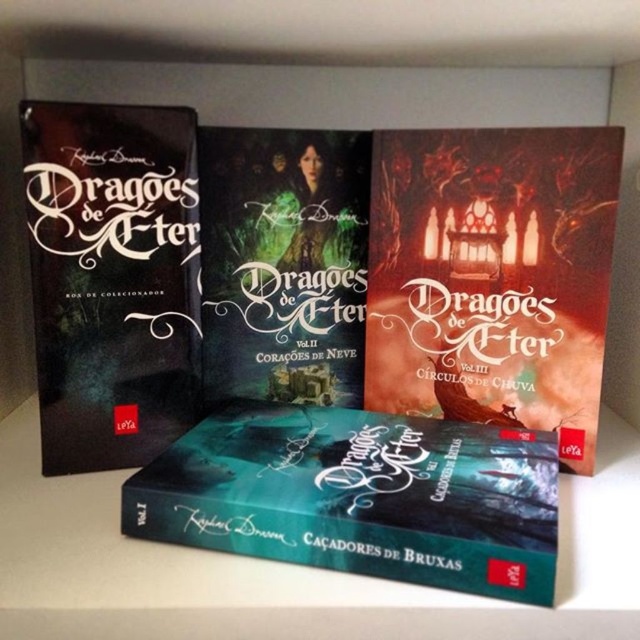
You are organizing a bookshelf and have two books to place side by side. The dark matte book at center and the teal glossy book at center. Which one will require more vertical space on the shelf?

The dark matte book at center requires more vertical space because it is much taller than the teal glossy book at center.

You are organizing a bookshelf and have two books to place side by side. The dark matte book at center and the teal glossy book at center. Given their sizes, which one should you place first to ensure they fit properly?

The dark matte book at center is bigger than the teal glossy book at center, so you should place the dark matte book at center first to accommodate its larger size before placing the smaller teal glossy book at center.